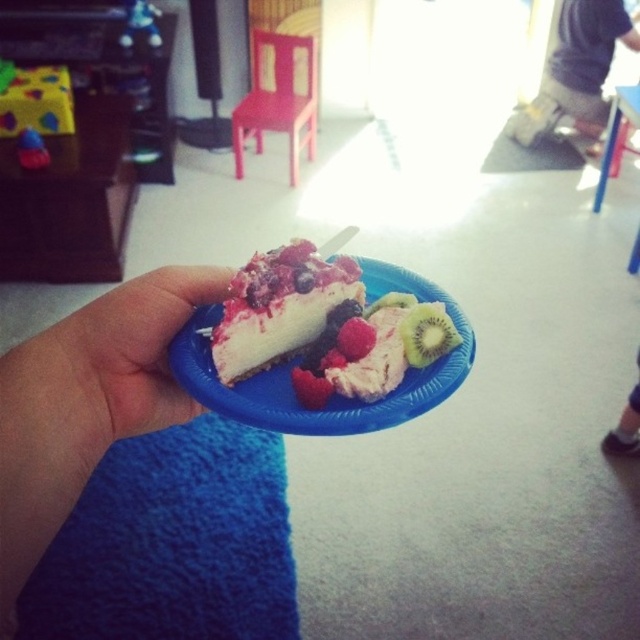
Between pink frosted cake at center and raspberry matte at center, which one appears on the left side from the viewer's perspective?

raspberry matte at center

Does pink frosted cake at center have a lesser height compared to raspberry matte at center?

No.

Find the location of a particular element. This screenshot has width=640, height=640. pink frosted cake at center is located at coordinates (374, 360).

Who is positioned more to the left, white creamy cheesecake at center or green textured kiwi at center?

white creamy cheesecake at center

Can you confirm if white creamy cheesecake at center is shorter than green textured kiwi at center?

No.

Does point (228, 307) come farther from viewer compared to point (403, 300)?

No.

The width and height of the screenshot is (640, 640). What are the coordinates of `white creamy cheesecake at center` in the screenshot? It's located at (280, 307).

Between blue plastic plate at center and green matte kiwi at center, which one is positioned lower?

Positioned lower is blue plastic plate at center.

Between blue plastic plate at center and green matte kiwi at center, which one has less height?

With less height is green matte kiwi at center.

Which is behind, point (403, 412) or point (428, 321)?

Point (428, 321)

I want to click on blue plastic plate at center, so click(333, 397).